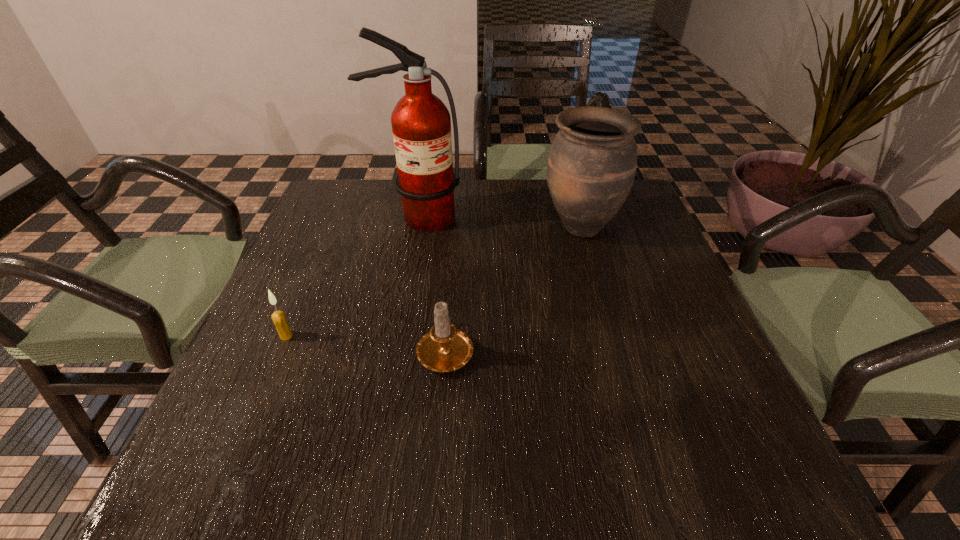
You are a GUI agent. You are given a task and a screenshot of the screen. Output one action in this format:
    pyautogui.click(x=<x>, y=<y>)
    Task: Click on the urn positioned at the far edge
    The height and width of the screenshot is (540, 960).
    Given the screenshot: What is the action you would take?
    pyautogui.click(x=592, y=163)

Where is `object located at the left edge`? The width and height of the screenshot is (960, 540). object located at the left edge is located at coordinates (279, 319).

The width and height of the screenshot is (960, 540). I want to click on object that is at the right edge, so click(592, 163).

This screenshot has width=960, height=540. In order to click on object that is at the far right corner in this screenshot , I will do `click(592, 163)`.

At what (x,y) coordinates should I click in order to perform the action: click on vacant space at the far edge. Please return your answer as a coordinate pair (x, y). Image resolution: width=960 pixels, height=540 pixels. Looking at the image, I should click on (526, 196).

Image resolution: width=960 pixels, height=540 pixels. What are the coordinates of `free space at the left edge of the desktop` in the screenshot? It's located at (310, 278).

This screenshot has width=960, height=540. Identify the location of free space at the right edge of the desktop. (666, 365).

In the image, there is a desktop. Identify the location of free space at the far left corner. (323, 197).

Locate an element on the screen. The image size is (960, 540). free space at the near left corner of the desktop is located at coordinates (283, 464).

In the image, there is a desktop. Where is `free space at the near right corner`? The image size is (960, 540). free space at the near right corner is located at coordinates [724, 471].